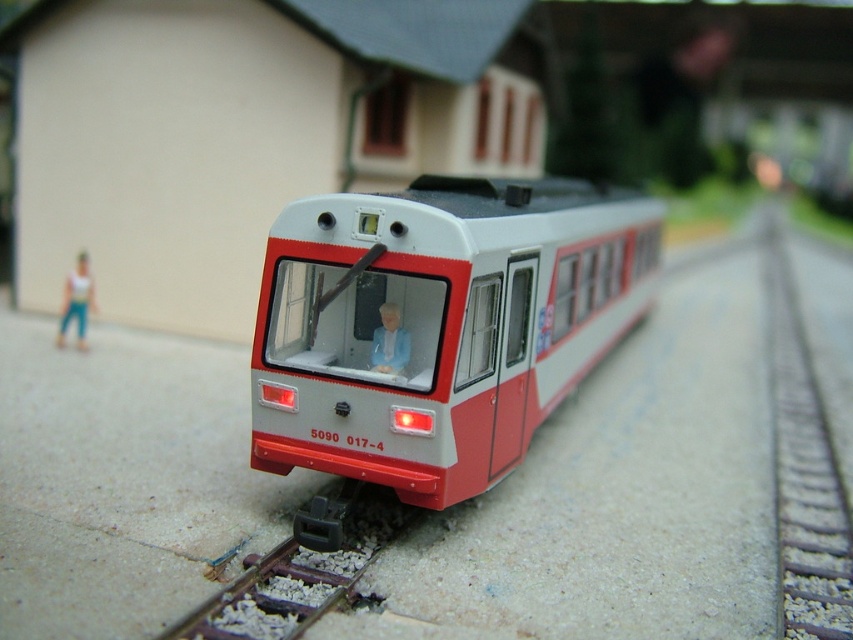
Question: Does matte white train at center come in front of smooth metal train track at center?

Choices:
 (A) yes
 (B) no

Answer: (B)

Question: Based on their relative distances, which object is nearer to the matte white train at center?

Choices:
 (A) light blue fabric jacket at center
 (B) white matte figure at left

Answer: (A)

Question: Does smooth metal train track at center appear over white matte figure at left?

Choices:
 (A) no
 (B) yes

Answer: (A)

Question: Which point is farther to the camera?

Choices:
 (A) smooth metal train track at center
 (B) matte white train at center

Answer: (B)

Question: Which point is farther to the camera?

Choices:
 (A) light blue fabric jacket at center
 (B) smooth metal train track at center
 (C) matte white train at center
 (D) white matte figure at left

Answer: (D)

Question: Observing the image, what is the correct spatial positioning of matte white train at center in reference to white matte figure at left?

Choices:
 (A) below
 (B) above

Answer: (B)